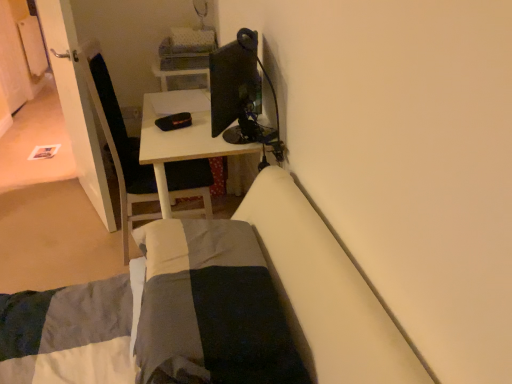
At what (x,y) coordinates should I click in order to perform the action: click on vacant space situated above white glossy desk at center (from a real-world perspective). Please return your answer as a coordinate pair (x, y). Looking at the image, I should click on (186, 114).